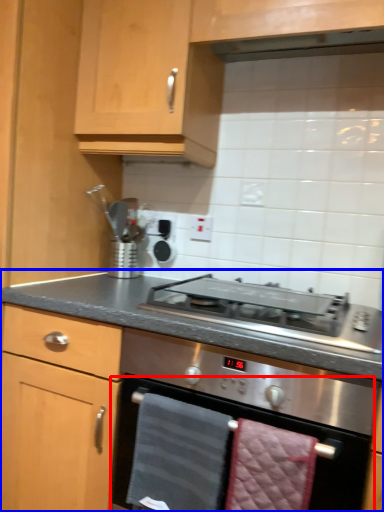
Question: Which object appears closest to the camera in this image, oven (highlighted by a red box) or countertop (highlighted by a blue box)?

Choices:
 (A) oven
 (B) countertop

Answer: (B)